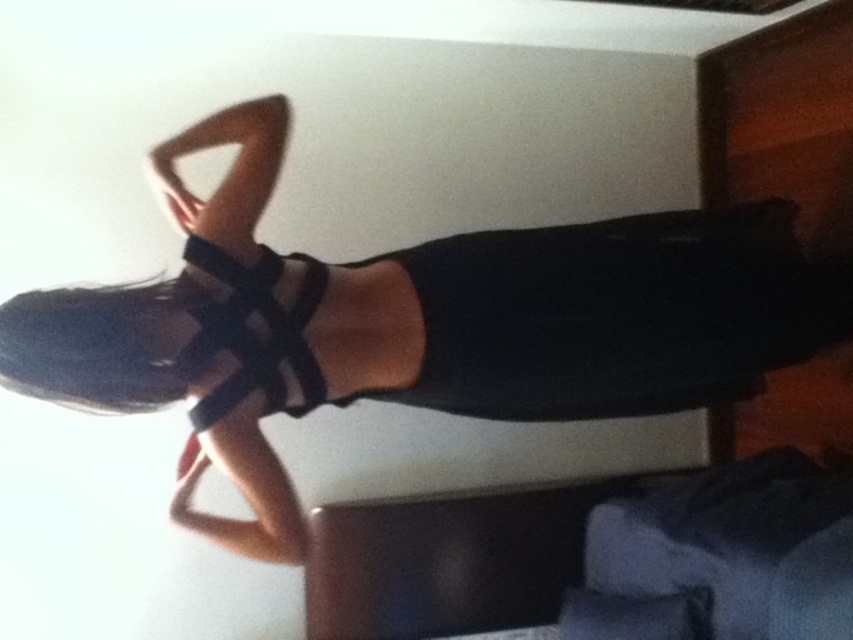
Question: Which object appears closest to the camera in this image?

Choices:
 (A) matte black dress at center
 (B) black mesh strap at center

Answer: (A)

Question: Which point is farther to the camera?

Choices:
 (A) matte black dress at center
 (B) black mesh strap at center

Answer: (B)

Question: Is matte black dress at center below black mesh strap at center?

Choices:
 (A) yes
 (B) no

Answer: (B)

Question: Is matte black dress at center to the right of black mesh strap at center from the viewer's perspective?

Choices:
 (A) no
 (B) yes

Answer: (B)

Question: Can you confirm if matte black dress at center is wider than black mesh strap at center?

Choices:
 (A) yes
 (B) no

Answer: (A)